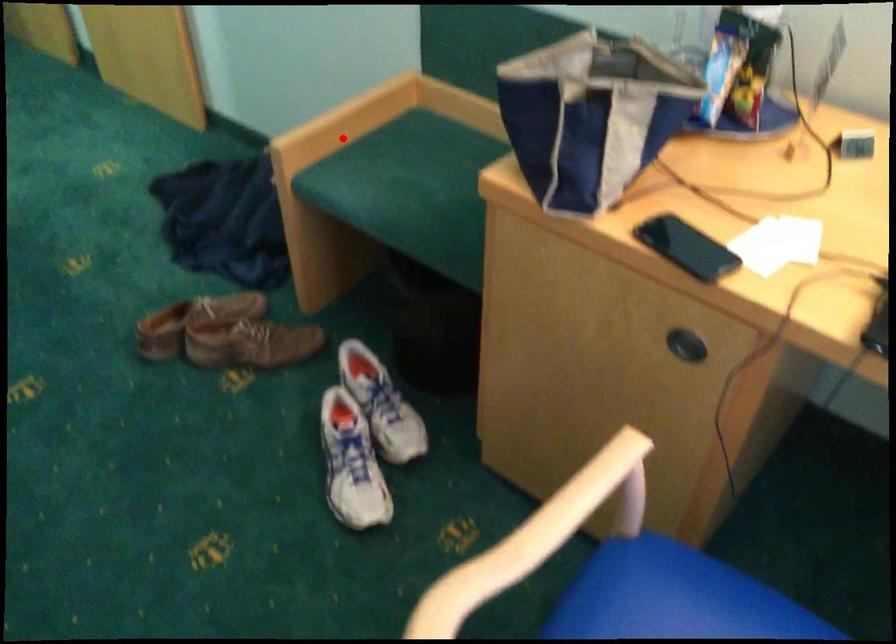
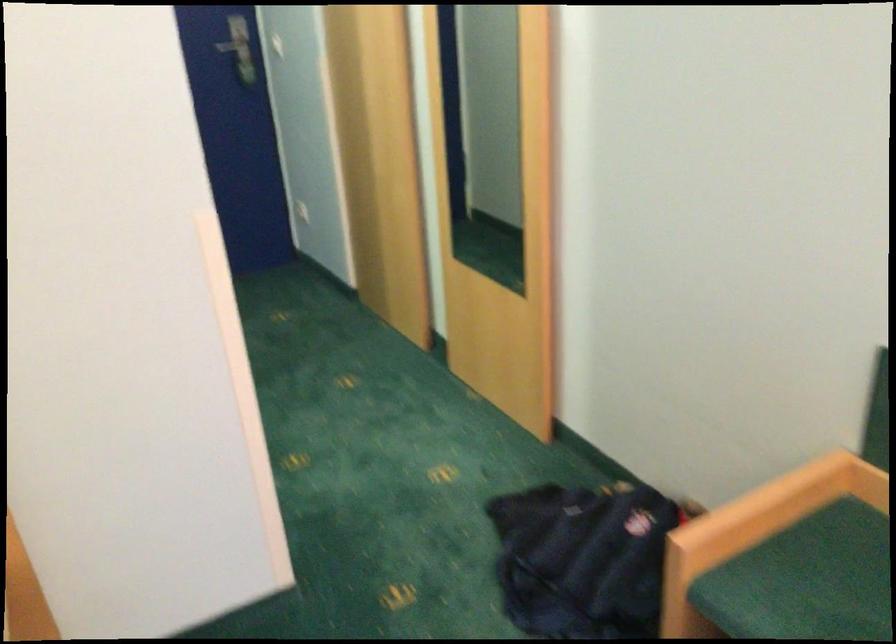
In the second image, find the point that corresponds to the highlighted location in the first image.

(756, 529)